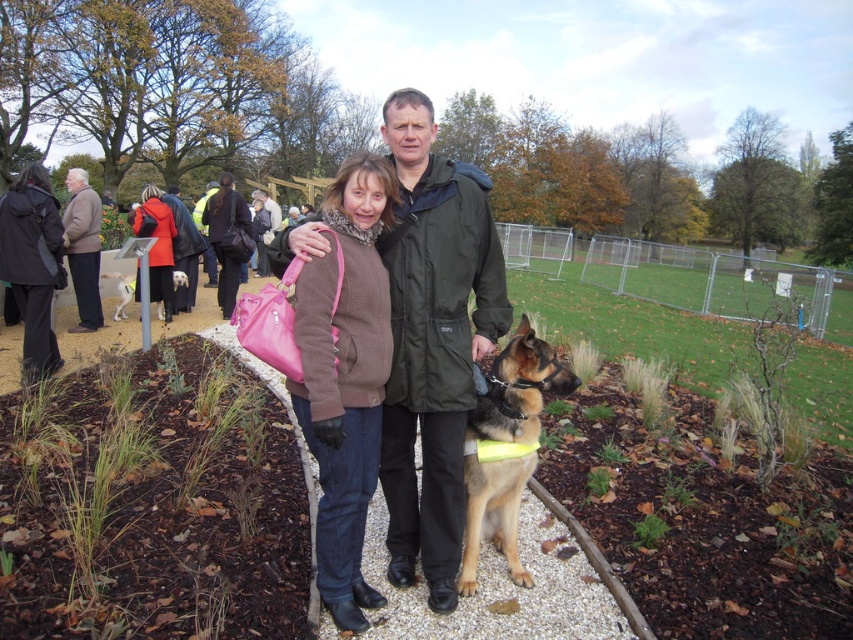
You are a photographer trying to capture a group photo of two people wearing dark gray wool coat at left and matte black jacket at center. If you want to ensure both subjects are framed equally in the photo, which person should you ask to move closer to the camera?

The dark gray wool coat at left is wider than the matte black jacket at center. To frame both subjects equally, the person wearing the dark gray wool coat at left should move closer to the camera so that their larger width appears smaller in the frame, balancing their size with the person in the matte black jacket at center.

You are standing in the park and see the matte black jacket at center and the white fur dog at left. Which object is positioned to the right of the other?

The matte black jacket at center is positioned to the right of the white fur dog at left.